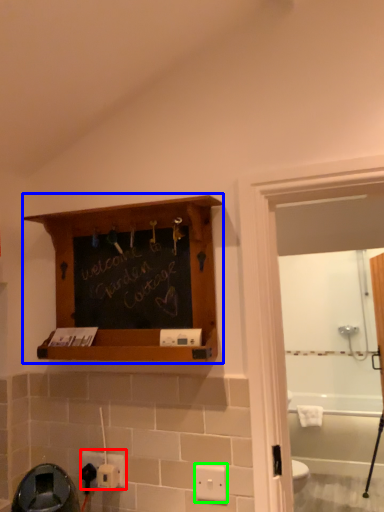
Question: Which object is the closest to the electric outlet (highlighted by a red box)? Choose among these: shelf (highlighted by a blue box) or light switch (highlighted by a green box).

Choices:
 (A) shelf
 (B) light switch

Answer: (B)